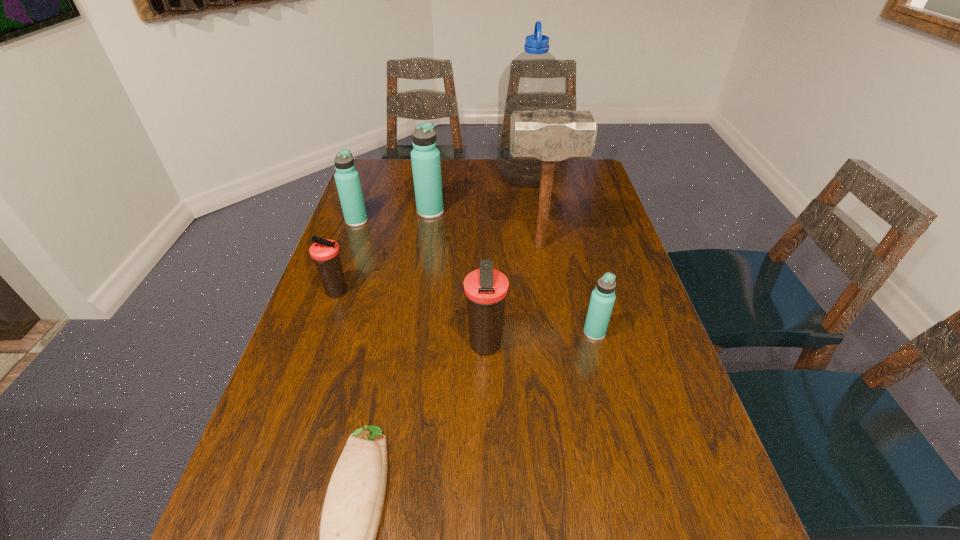
Locate an element on the screen. The height and width of the screenshot is (540, 960). free space located 0.050m on the front of the left brown thermos bottle is located at coordinates (328, 317).

You are a GUI agent. You are given a task and a screenshot of the screen. Output one action in this format:
    pyautogui.click(x=<x>, y=<y>)
    Task: Click on the vacant space located on the left of the rightmost thermos bottle
    
    Given the screenshot: What is the action you would take?
    pyautogui.click(x=494, y=333)

Where is `object located at the far edge`? The height and width of the screenshot is (540, 960). object located at the far edge is located at coordinates (534, 80).

At what (x,y) coordinates should I click in order to perform the action: click on water jug that is at the right edge. Please return your answer as a coordinate pair (x, y). The image size is (960, 540). Looking at the image, I should click on (534, 80).

What are the coordinates of `mallet that is at the right edge` in the screenshot? It's located at (550, 135).

Find the location of a particular element. Image resolution: width=960 pixels, height=540 pixels. thermos bottle present at the right edge is located at coordinates click(x=602, y=300).

What are the coordinates of `object that is at the far right corner` in the screenshot? It's located at (x=534, y=80).

Locate an element on the screen. This screenshot has width=960, height=540. vacant space at the far edge is located at coordinates (405, 184).

Find the location of a particular element. The height and width of the screenshot is (540, 960). free space at the left edge of the desktop is located at coordinates (375, 281).

Find the location of a particular element. This screenshot has width=960, height=540. vacant space at the right edge is located at coordinates (634, 282).